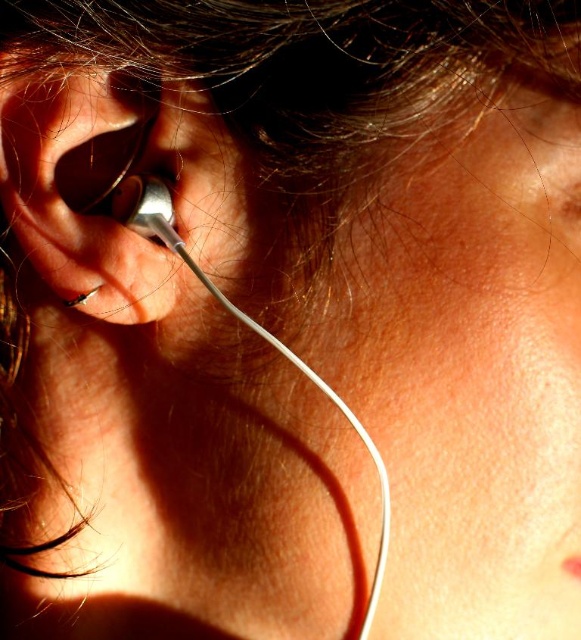
Question: Can you confirm if silver metallic earbud at left is positioned to the left of silver metallic earring at left?

Choices:
 (A) no
 (B) yes

Answer: (B)

Question: Which object appears closest to the camera in this image?

Choices:
 (A) silver metallic earbud at left
 (B) silver metallic earring at left

Answer: (A)

Question: Is silver metallic earbud at left wider than silver metallic earring at left?

Choices:
 (A) yes
 (B) no

Answer: (B)

Question: Is silver metallic earbud at left thinner than silver metallic earring at left?

Choices:
 (A) yes
 (B) no

Answer: (A)